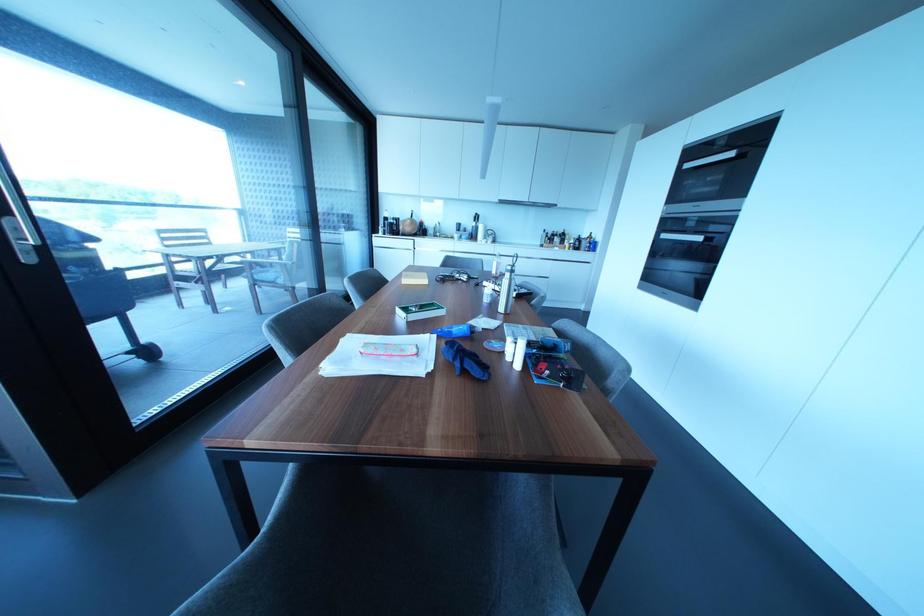
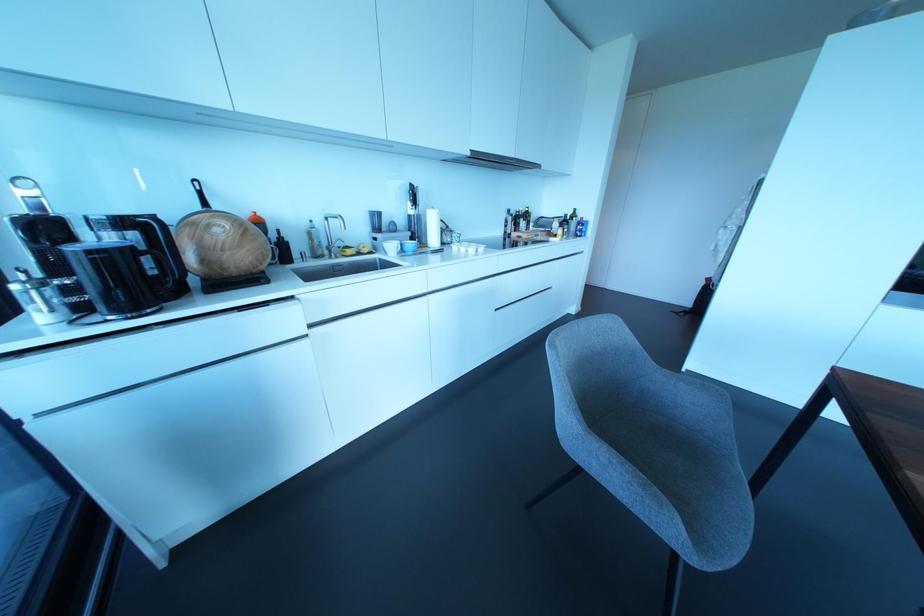
The point at (472,224) is marked in the first image. Where is the corresponding point in the second image?

(410, 211)